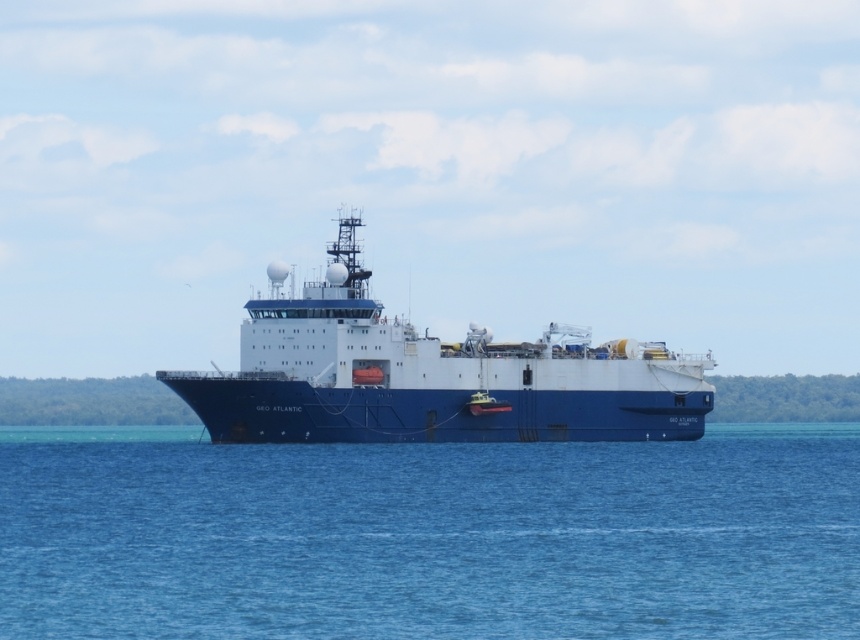
Can you confirm if blue liquid water at center is wider than blue matte ship at center?

Yes.

Can you confirm if blue liquid water at center is smaller than blue matte ship at center?

Yes.

From the picture: Who is more distant from viewer, (401, 500) or (480, 362)?

The point (480, 362) is more distant.

The height and width of the screenshot is (640, 860). What are the coordinates of `blue liquid water at center` in the screenshot? It's located at (430, 536).